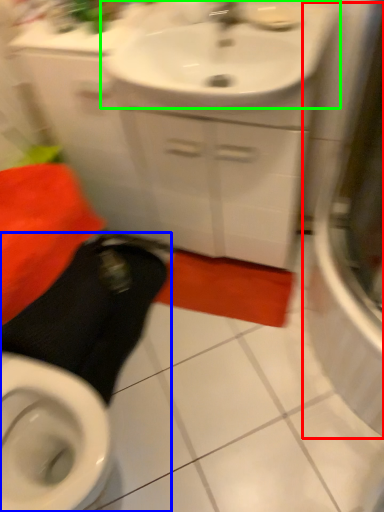
Question: Considering the real-world distances, which object is farthest from screen door (highlighted by a red box)? squat (highlighted by a blue box) or sink (highlighted by a green box)?

Choices:
 (A) squat
 (B) sink

Answer: (A)